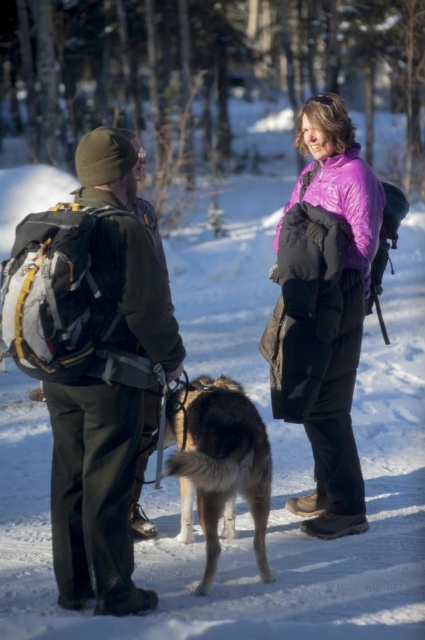
What do you see at coordinates (93, 362) in the screenshot? Image resolution: width=425 pixels, height=640 pixels. I see `green fabric jacket at left` at bounding box center [93, 362].

Is green fabric jacket at left wider than purple fleece jacket at center?

Incorrect, green fabric jacket at left's width does not surpass purple fleece jacket at center's.

Between point (118, 483) and point (67, 589), which one is positioned behind?

The point (67, 589) is behind.

The image size is (425, 640). I want to click on green fabric jacket at left, so click(x=93, y=362).

Is point (379, 212) less distant than point (294, 252)?

That is False.

Between purple fleece jacket at center and purple down jacket at center, which one is positioned lower?

purple down jacket at center is below.

Does point (331, 204) lie behind point (342, 163)?

No, it is in front of (342, 163).

Locate an element on the screen. purple fleece jacket at center is located at coordinates (325, 308).

Measure the distance from green fabric jacket at left to fluffy brown dog at center.

green fabric jacket at left and fluffy brown dog at center are 26.87 inches apart from each other.

Find the location of a particular element. The width and height of the screenshot is (425, 640). green fabric jacket at left is located at coordinates (93, 362).

Who is more distant from viewer, (82,160) or (212,516)?

Point (212,516)

Identify the location of green fabric jacket at left. The width and height of the screenshot is (425, 640). (93, 362).